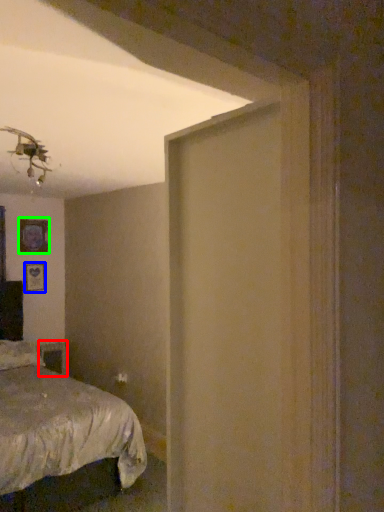
Question: Estimate the real-world distances between objects in this image. Which object is closer to table (highlighted by a red box), picture frame (highlighted by a blue box) or picture frame (highlighted by a green box)?

Choices:
 (A) picture frame
 (B) picture frame

Answer: (A)